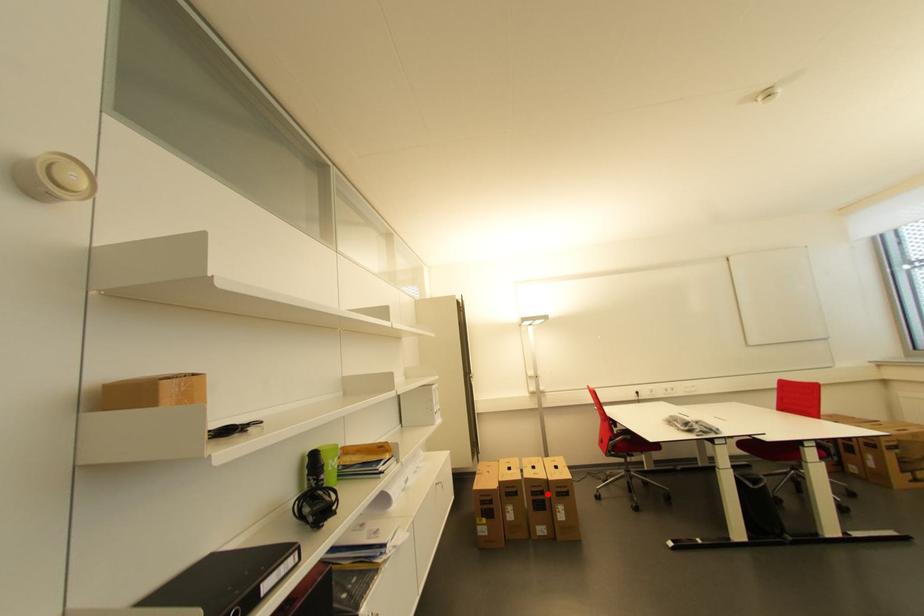
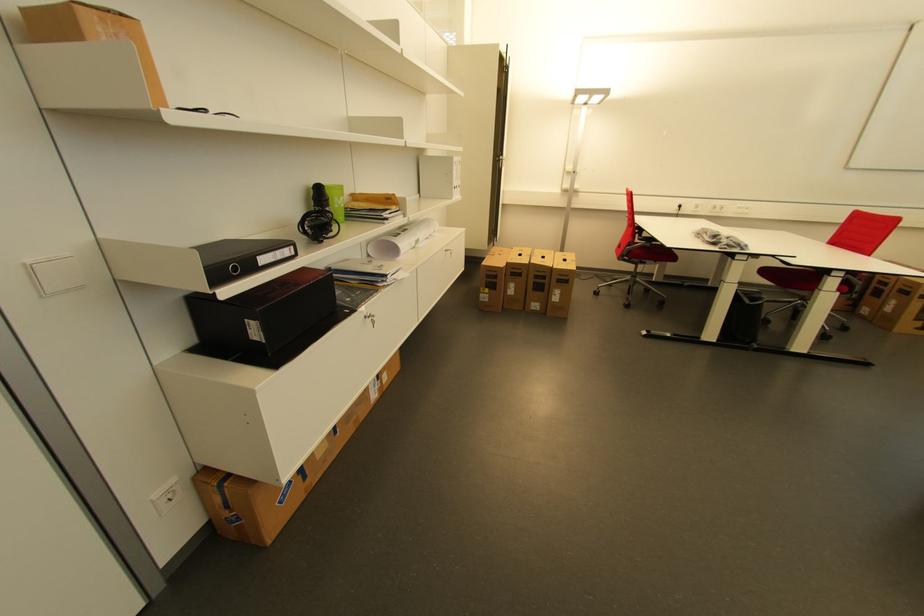
Question: I am providing you with two images of the same scene from different viewpoints. Image1 has a red point marked. In image2, the corresponding 3D location appears at what relative position? Reply with the corresponding letter.

Choices:
 (A) Closer
 (B) Farther

Answer: (A)